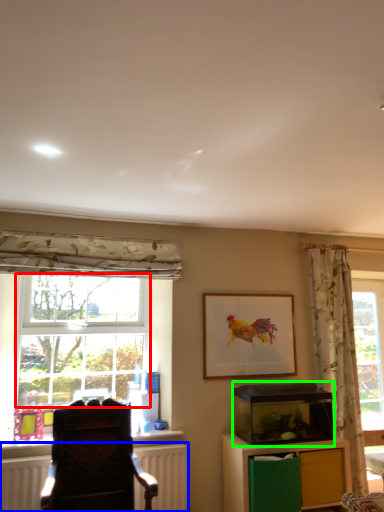
Question: Which is nearer to the bay window (highlighted by a red box)? radiator (highlighted by a blue box) or appliance (highlighted by a green box).

Choices:
 (A) radiator
 (B) appliance

Answer: (A)